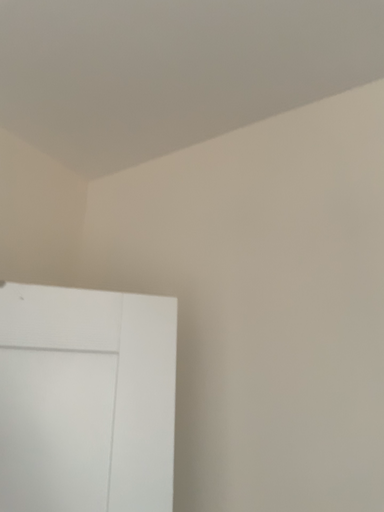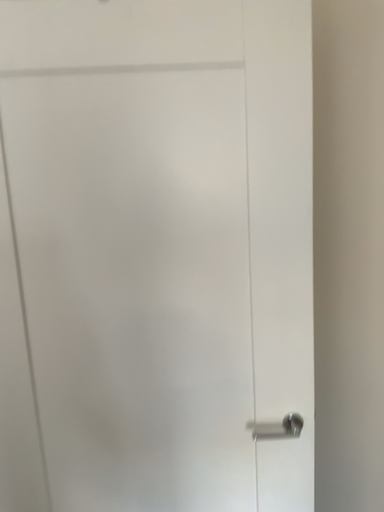
Question: How did the camera likely rotate when shooting the video?

Choices:
 (A) rotated right
 (B) rotated left

Answer: (B)